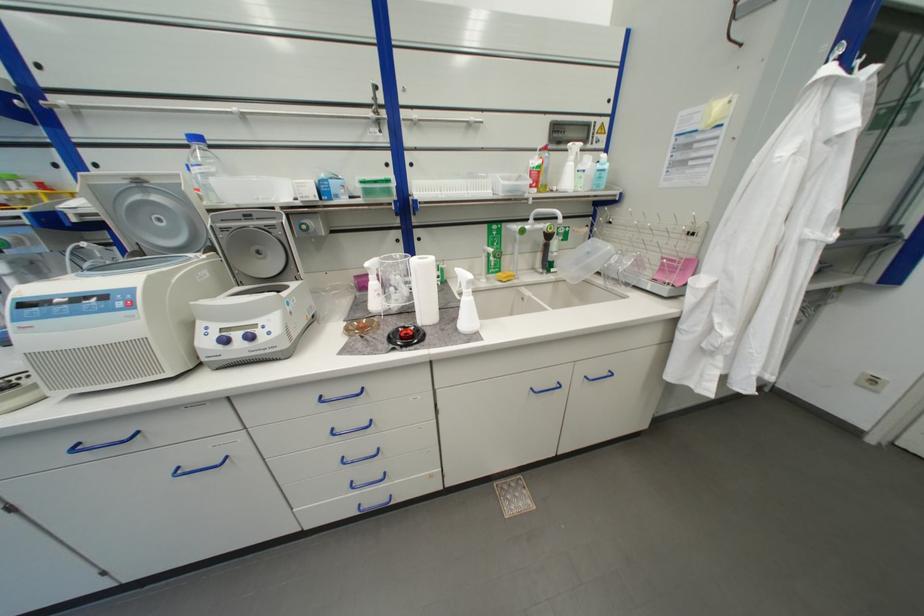
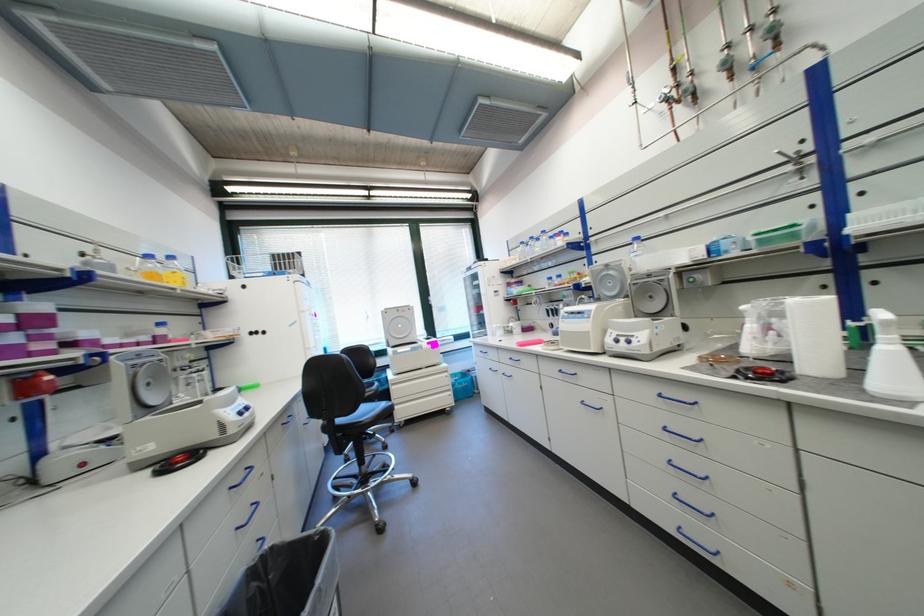
Question: Based on the continuous images, in which direction is the camera rotating? Reply with the corresponding letter.

Choices:
 (A) Left
 (B) Right
 (C) Up
 (D) Down

Answer: (A)